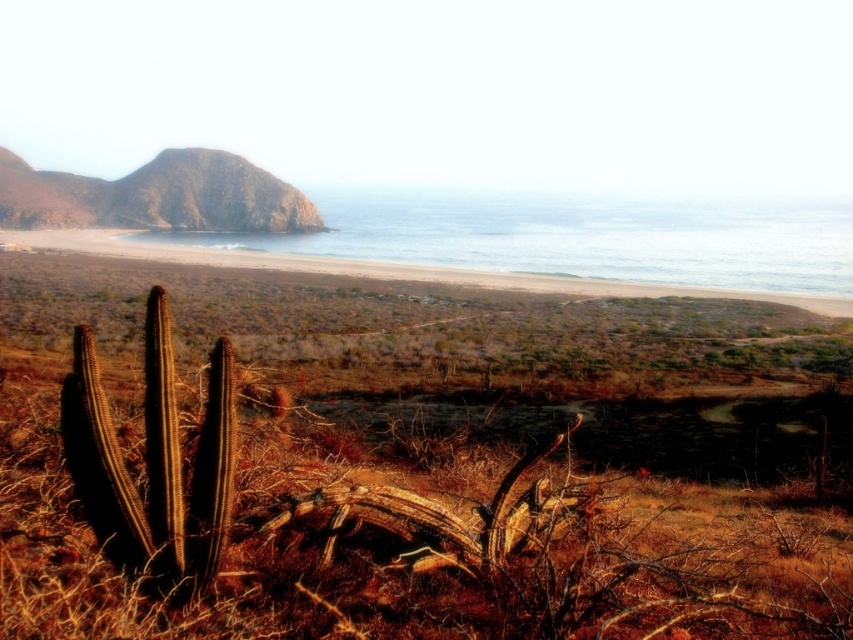
Can you confirm if clear blue water at upper center is bigger than green mossy rock at upper left?

Yes.

Does clear blue water at upper center appear on the right side of green mossy rock at upper left?

Yes, clear blue water at upper center is to the right of green mossy rock at upper left.

Which is behind, point (608, 205) or point (247, 214)?

Positioned behind is point (608, 205).

This screenshot has width=853, height=640. What are the coordinates of `clear blue water at upper center` in the screenshot? It's located at click(577, 236).